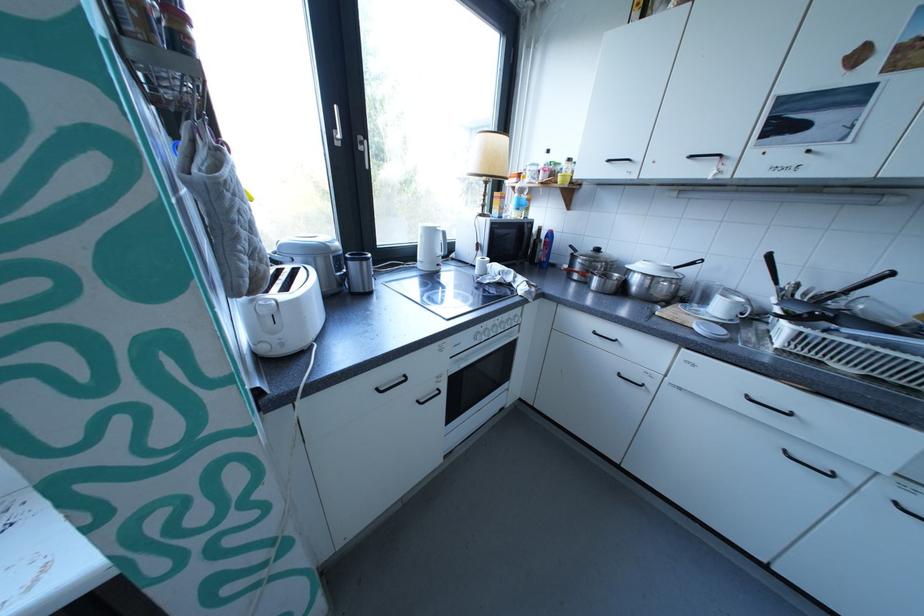
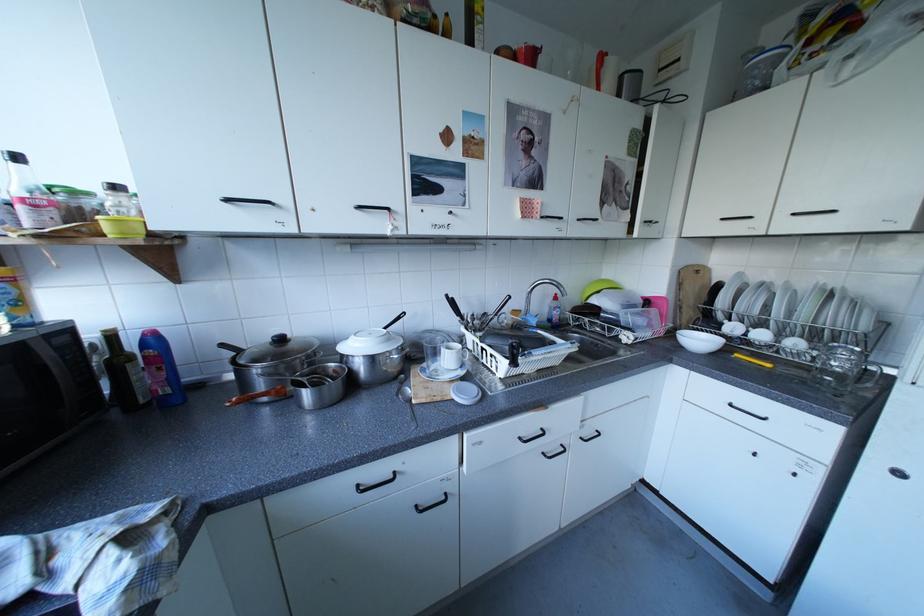
Where in the second image is the point corresponding to pixel 797 450 from the first image?

(555, 454)